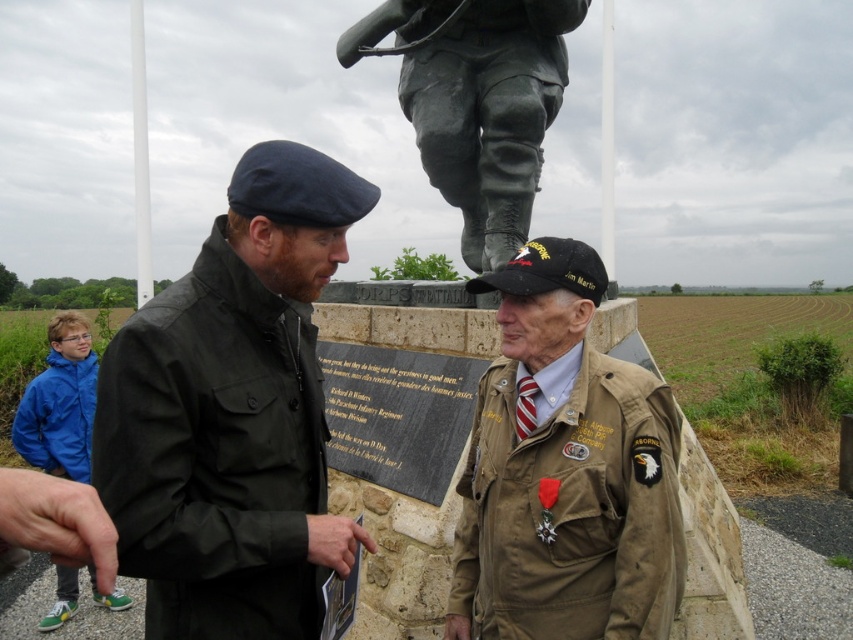
You are a photographer trying to capture a group photo of the dark green fabric jacket at center and the tan fabric jacket at lower right. Based on their positions, which jacket should be placed on the left side of the photo to ensure both are fully visible in the frame?

The dark green fabric jacket at center should be placed on the left side of the photo because it is wider than the tan fabric jacket at lower right, allowing both to fit within the frame without overlapping.

You are a photographer standing at the center of the memorial. You want to take a photo that includes both the bronze statue of a soldier and the dark green fabric jacket at center. Based on their positions, which object is closer to you?

The dark green fabric jacket at center is closer to you because it is positioned at point (x=233, y=413), which is closer to the center than the bronze statue of a soldier.